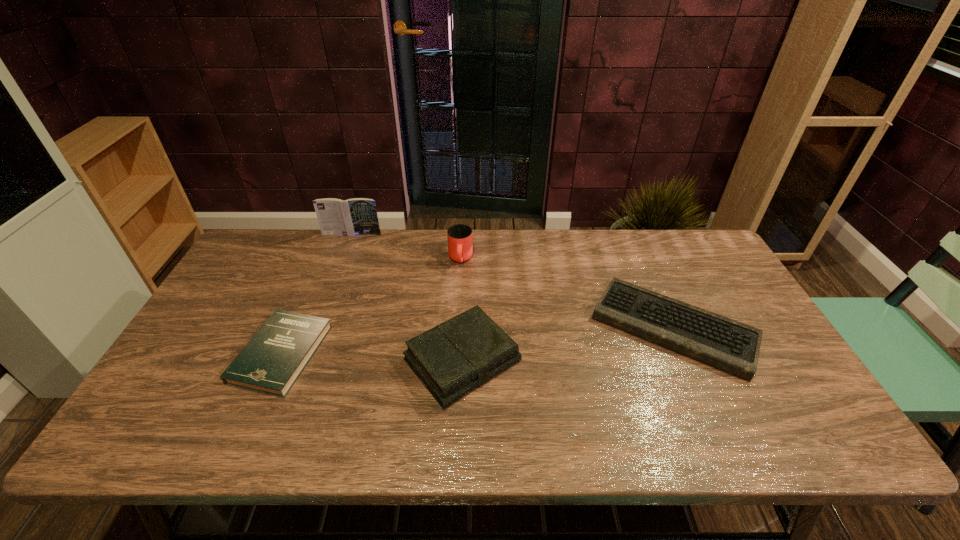
Image resolution: width=960 pixels, height=540 pixels. What are the coordinates of `free space that satisfies the following two spatial constraints: 1. on the front cover of the second shortest book; 2. on the right side of the tallest object` in the screenshot? It's located at (304, 360).